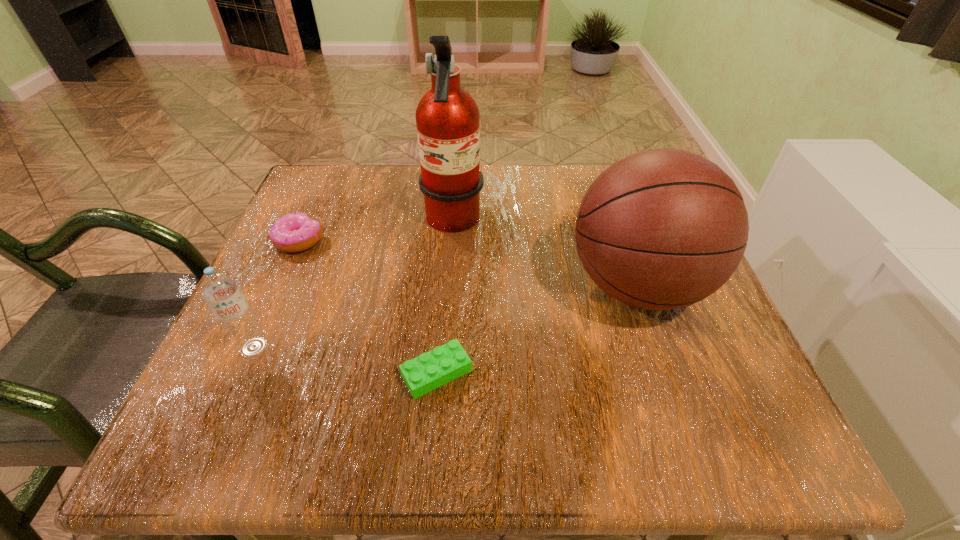
You are a GUI agent. You are given a task and a screenshot of the screen. Output one action in this format:
    pyautogui.click(x=<x>, y=<y>)
    Task: Click on the fire extinguisher
    The image size is (960, 540).
    Given the screenshot: What is the action you would take?
    pyautogui.click(x=447, y=118)

Find the location of a particular element. The height and width of the screenshot is (540, 960). basketball is located at coordinates (661, 229).

Where is `the second tallest object`? The image size is (960, 540). the second tallest object is located at coordinates (661, 229).

At what (x,y) coordinates should I click in order to perform the action: click on the third shortest object. Please return your answer as a coordinate pair (x, y). This screenshot has height=540, width=960. Looking at the image, I should click on (220, 290).

Where is `doughnut`? doughnut is located at coordinates (295, 232).

What are the coordinates of `the shortest object` in the screenshot? It's located at (430, 370).

Where is `free location located 0.300m on the nozzle and handle of the tallest object`? Image resolution: width=960 pixels, height=540 pixels. free location located 0.300m on the nozzle and handle of the tallest object is located at coordinates (623, 224).

Identify the location of free spot located 0.110m on the front of the basketball. (678, 404).

Where is `free region located on the back of the water bottle`? free region located on the back of the water bottle is located at coordinates (290, 265).

What are the coordinates of `free space located 0.130m on the back of the doughnut` in the screenshot? It's located at (322, 190).